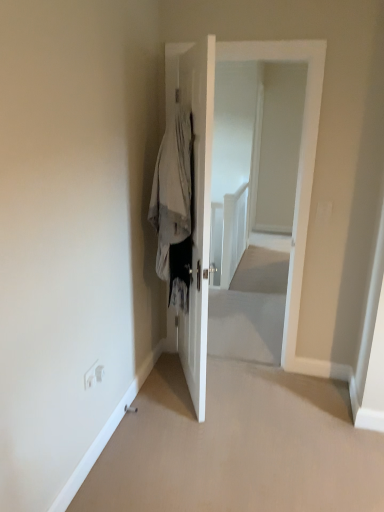
Question: From a real-world perspective, is white glossy door at center, placed as the 1th door when sorted from left to right, above or below white glossy door at center, which is the first door in right-to-left order?

Choices:
 (A) above
 (B) below

Answer: (B)

Question: Is white glossy door at center, placed as the 1th door when sorted from left to right, inside the boundaries of white glossy door at center, which is the first door in right-to-left order, or outside?

Choices:
 (A) outside
 (B) inside

Answer: (A)

Question: Estimate the real-world distances between objects in this image. Which object is closer to the white glossy door at center, marked as the second door in a left-to-right arrangement?

Choices:
 (A) light gray fabric coat at center
 (B) white glossy door at center, positioned as the 2th door in right-to-left order

Answer: (B)

Question: Which of these objects is positioned closest to the white glossy door at center, positioned as the 2th door in right-to-left order?

Choices:
 (A) white glossy door at center, which is the first door in right-to-left order
 (B) light gray fabric coat at center

Answer: (B)